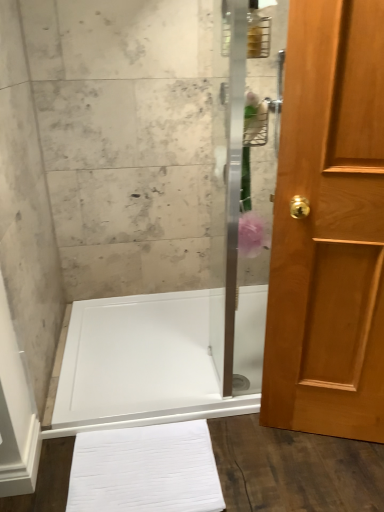
Question: Is white glossy shower tray at center facing towards light brown wood door at right?

Choices:
 (A) no
 (B) yes

Answer: (A)

Question: Considering the relative sizes of white glossy shower tray at center and light brown wood door at right in the image provided, is white glossy shower tray at center smaller than light brown wood door at right?

Choices:
 (A) yes
 (B) no

Answer: (A)

Question: From the image's perspective, is white glossy shower tray at center located beneath light brown wood door at right?

Choices:
 (A) yes
 (B) no

Answer: (A)

Question: From a real-world perspective, is white glossy shower tray at center below light brown wood door at right?

Choices:
 (A) no
 (B) yes

Answer: (B)

Question: Does white glossy shower tray at center appear on the right side of light brown wood door at right?

Choices:
 (A) yes
 (B) no

Answer: (B)

Question: Based on their sizes in the image, would you say light brown wood door at right is bigger or smaller than white glossy shower tray at center?

Choices:
 (A) big
 (B) small

Answer: (A)

Question: Is point tap(359, 52) closer or farther from the camera than point tap(142, 375)?

Choices:
 (A) farther
 (B) closer

Answer: (B)

Question: Considering the positions of light brown wood door at right and white glossy shower tray at center in the image, is light brown wood door at right wider or thinner than white glossy shower tray at center?

Choices:
 (A) wide
 (B) thin

Answer: (B)

Question: From a real-world perspective, is light brown wood door at right physically located above or below white glossy shower tray at center?

Choices:
 (A) above
 (B) below

Answer: (A)

Question: Looking at their shapes, would you say clear glass shower door at center is wider or thinner than white glossy shower tray at center?

Choices:
 (A) thin
 (B) wide

Answer: (A)

Question: Relative to white glossy shower tray at center, is clear glass shower door at center in front or behind?

Choices:
 (A) behind
 (B) front

Answer: (B)

Question: From a real-world perspective, is clear glass shower door at center above or below white glossy shower tray at center?

Choices:
 (A) above
 (B) below

Answer: (A)

Question: Is clear glass shower door at center situated inside white glossy shower tray at center or outside?

Choices:
 (A) outside
 (B) inside

Answer: (A)

Question: From the image's perspective, relative to light brown wood door at right, is white glossy shower tray at center above or below?

Choices:
 (A) below
 (B) above

Answer: (A)

Question: Do you think white glossy shower tray at center is within light brown wood door at right, or outside of it?

Choices:
 (A) inside
 (B) outside

Answer: (B)